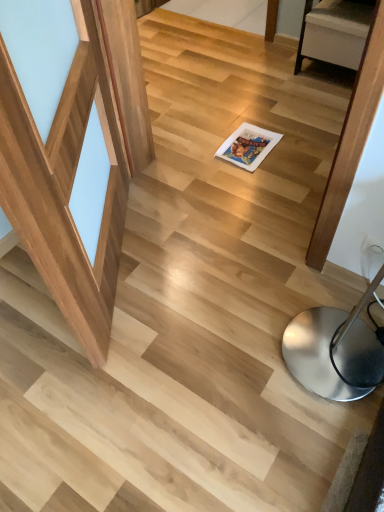
Identify the location of vacant space situated above matte paper magazine at center (from a real-world perspective). The height and width of the screenshot is (512, 384). (248, 145).